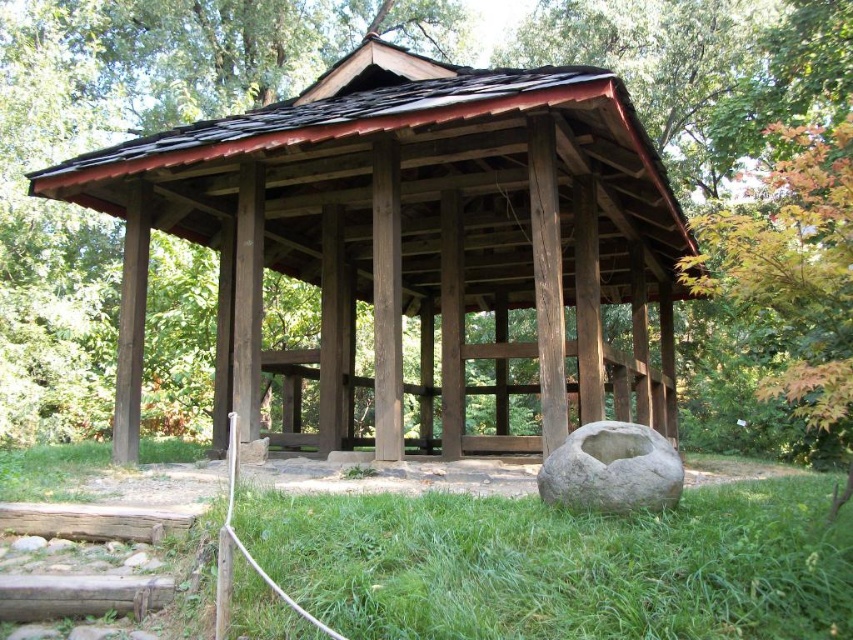
Question: Estimate the real-world distances between objects in this image. Which object is farther from the brown wooden gazebo at center?

Choices:
 (A) gray stone bowl at lower center
 (B) green grass at lower center

Answer: (A)

Question: From the image, what is the correct spatial relationship of brown wooden gazebo at center in relation to gray stone bowl at lower center?

Choices:
 (A) left
 (B) right

Answer: (A)

Question: Which object is farther from the camera taking this photo?

Choices:
 (A) gray stone bowl at lower center
 (B) green grass at lower center
 (C) brown wooden gazebo at center

Answer: (C)

Question: Is the position of brown wooden gazebo at center less distant than that of gray stone bowl at lower center?

Choices:
 (A) no
 (B) yes

Answer: (A)

Question: Which is farther from the green grass at lower center?

Choices:
 (A) brown wooden gazebo at center
 (B) gray stone bowl at lower center

Answer: (A)

Question: Does brown wooden gazebo at center appear over green grass at lower center?

Choices:
 (A) no
 (B) yes

Answer: (B)